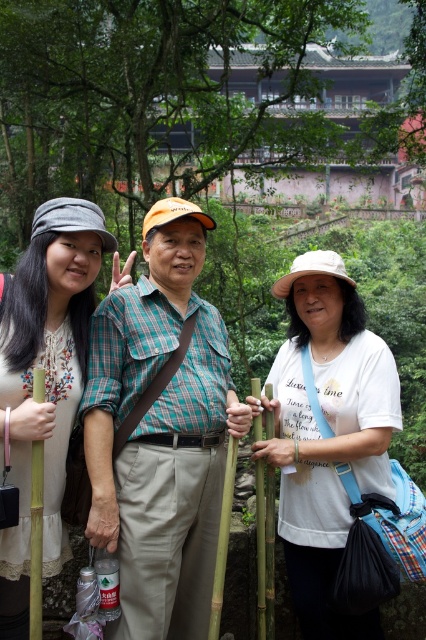
Question: Which object is positioned closest to the green bamboo pole at center?

Choices:
 (A) green plaid shirt at center
 (B) white cotton hat at center
 (C) matte white blouse at left
 (D) green bamboo pole at left

Answer: (B)

Question: Is green plaid shirt at center to the left of green bamboo pole at center from the viewer's perspective?

Choices:
 (A) no
 (B) yes

Answer: (B)

Question: Which point appears closest to the camera in this image?

Choices:
 (A) (23, 275)
 (B) (42, 461)

Answer: (B)

Question: Is white cotton hat at center further to camera compared to matte white blouse at left?

Choices:
 (A) yes
 (B) no

Answer: (A)

Question: Can you confirm if white cotton hat at center is wider than matte white blouse at left?

Choices:
 (A) yes
 (B) no

Answer: (A)

Question: Which object is the closest to the matte white blouse at left?

Choices:
 (A) green bamboo pole at center
 (B) green bamboo pole at left
 (C) green plaid shirt at center
 (D) white cotton hat at center

Answer: (C)